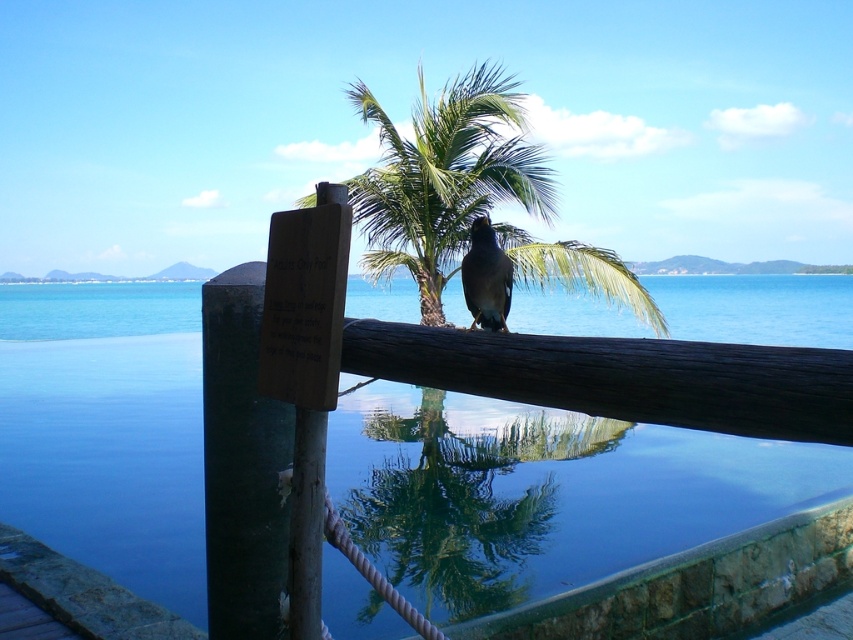
Question: Among these points, which one is farthest from the camera?

Choices:
 (A) (361, 524)
 (B) (502, 268)

Answer: (A)

Question: Is transparent glass water at center further to the viewer compared to shiny brown bird at center?

Choices:
 (A) yes
 (B) no

Answer: (B)

Question: Does transparent glass water at center appear under shiny brown bird at center?

Choices:
 (A) yes
 (B) no

Answer: (B)

Question: Is transparent glass water at center positioned in front of shiny brown bird at center?

Choices:
 (A) yes
 (B) no

Answer: (A)